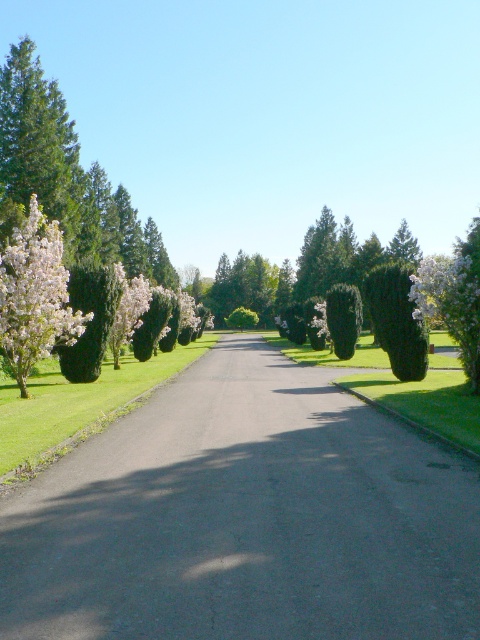
Is white fluffy flower at left smaller than green leafy bush at center?

Indeed, white fluffy flower at left has a smaller size compared to green leafy bush at center.

Is white fluffy flower at left wider than green leafy bush at center?

In fact, white fluffy flower at left might be narrower than green leafy bush at center.

Is point (145, 289) positioned behind point (244, 326)?

No, it is in front of (244, 326).

Image resolution: width=480 pixels, height=640 pixels. What are the coordinates of `white fluffy flower at left` in the screenshot? It's located at (129, 308).

Does fluffy white blossoms at left appear over white matte flower at center?

Yes.

Find the location of a particular element. This screenshot has height=640, width=480. fluffy white blossoms at left is located at coordinates (66, 179).

Where is `fluffy white blossoms at left`? fluffy white blossoms at left is located at coordinates (66, 179).

Is fluffy white blossoms at left closer to camera compared to green textured hedge at center-right?

Yes.

Does fluffy white blossoms at left have a greater width compared to green textured hedge at center-right?

Indeed, fluffy white blossoms at left has a greater width compared to green textured hedge at center-right.

The image size is (480, 640). I want to click on fluffy white blossoms at left, so click(66, 179).